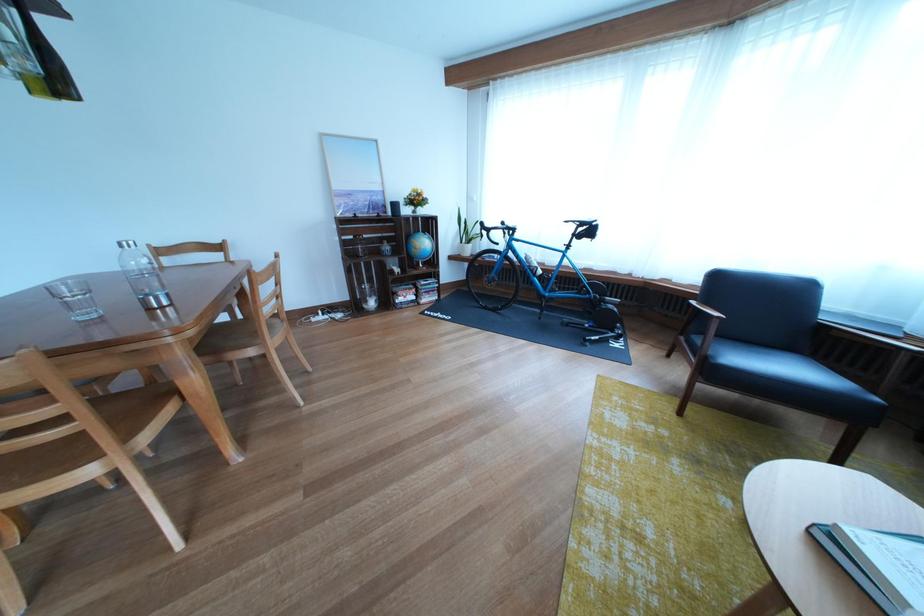
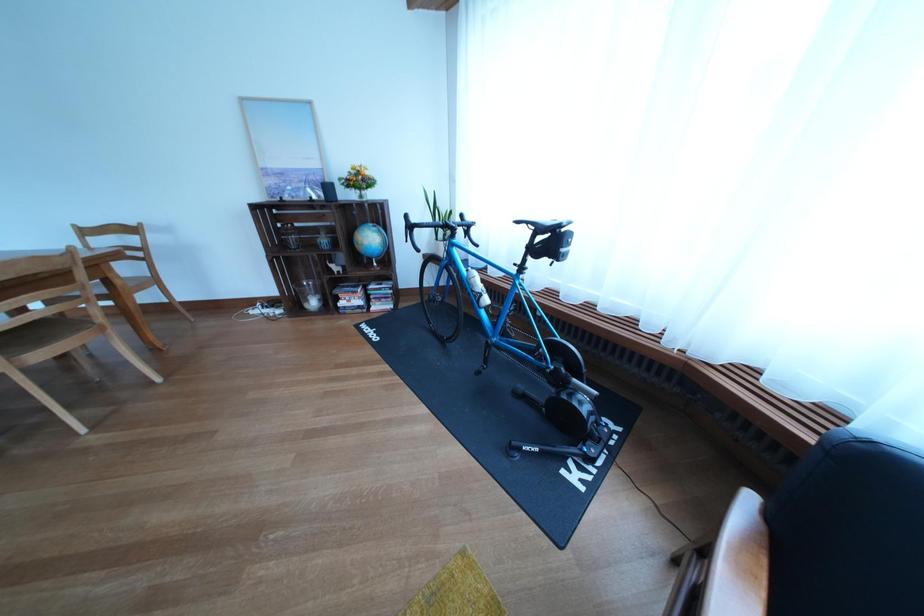
Locate, in the second image, the point that corresponds to [602,237] in the first image.

(563, 248)